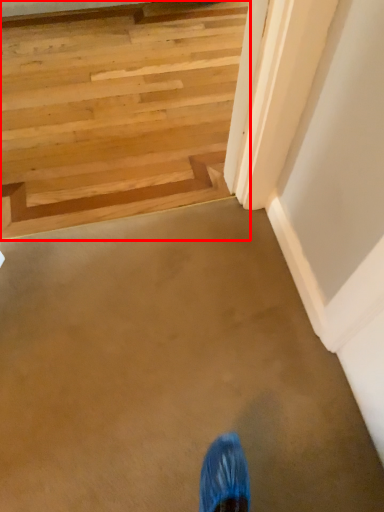
Question: Observing the image, what is the correct spatial positioning of stairs (annotated by the red box) in reference to stairwell?

Choices:
 (A) left
 (B) right

Answer: (B)